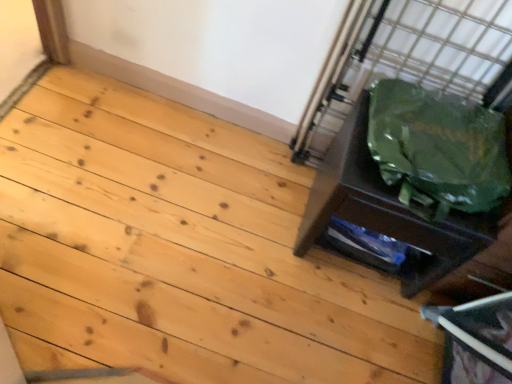
Question: Does green fabric bag at right have a larger size compared to natural wood floor at lower right?

Choices:
 (A) yes
 (B) no

Answer: (A)

Question: Is green fabric bag at right smaller than natural wood floor at lower right?

Choices:
 (A) no
 (B) yes

Answer: (A)

Question: Does green fabric bag at right have a lesser width compared to natural wood floor at lower right?

Choices:
 (A) yes
 (B) no

Answer: (A)

Question: From a real-world perspective, does green fabric bag at right stand above natural wood floor at lower right?

Choices:
 (A) yes
 (B) no

Answer: (A)

Question: Does green fabric bag at right lie behind natural wood floor at lower right?

Choices:
 (A) no
 (B) yes

Answer: (B)

Question: Is green fabric bag at right placed right next to natural wood floor at lower right?

Choices:
 (A) no
 (B) yes

Answer: (A)

Question: Is green plastic bag at right facing towards natural wood floor at lower right?

Choices:
 (A) yes
 (B) no

Answer: (B)

Question: From a real-world perspective, is green plastic bag at right under natural wood floor at lower right?

Choices:
 (A) yes
 (B) no

Answer: (B)

Question: From the image's perspective, is green plastic bag at right located beneath natural wood floor at lower right?

Choices:
 (A) no
 (B) yes

Answer: (A)

Question: Does green plastic bag at right have a smaller size compared to natural wood floor at lower right?

Choices:
 (A) no
 (B) yes

Answer: (B)

Question: From a real-world perspective, is green plastic bag at right positioned over natural wood floor at lower right based on gravity?

Choices:
 (A) yes
 (B) no

Answer: (A)

Question: Is green plastic bag at right not within natural wood floor at lower right?

Choices:
 (A) yes
 (B) no

Answer: (A)

Question: Considering the relative sizes of natural wood floor at lower right and green plastic bag at right in the image provided, is natural wood floor at lower right smaller than green plastic bag at right?

Choices:
 (A) yes
 (B) no

Answer: (B)